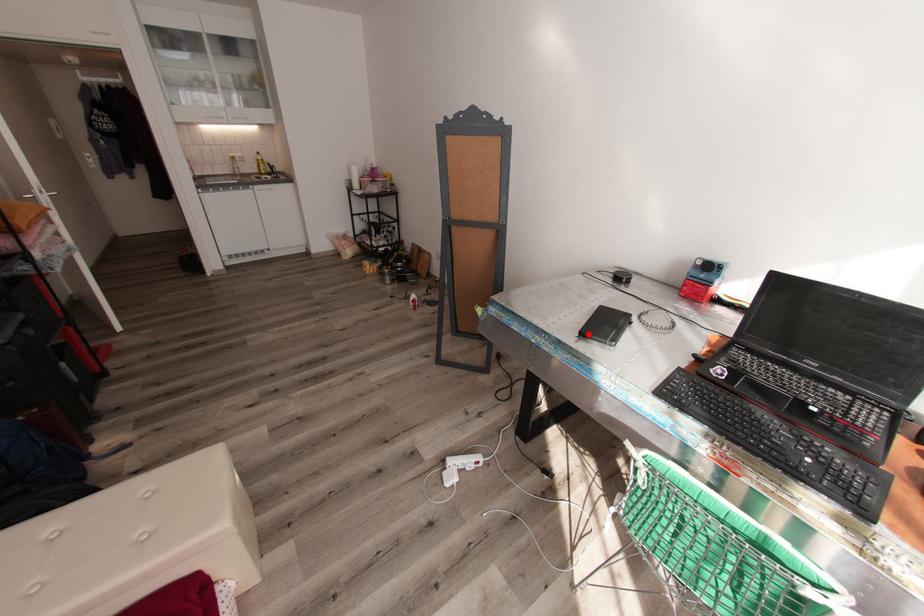
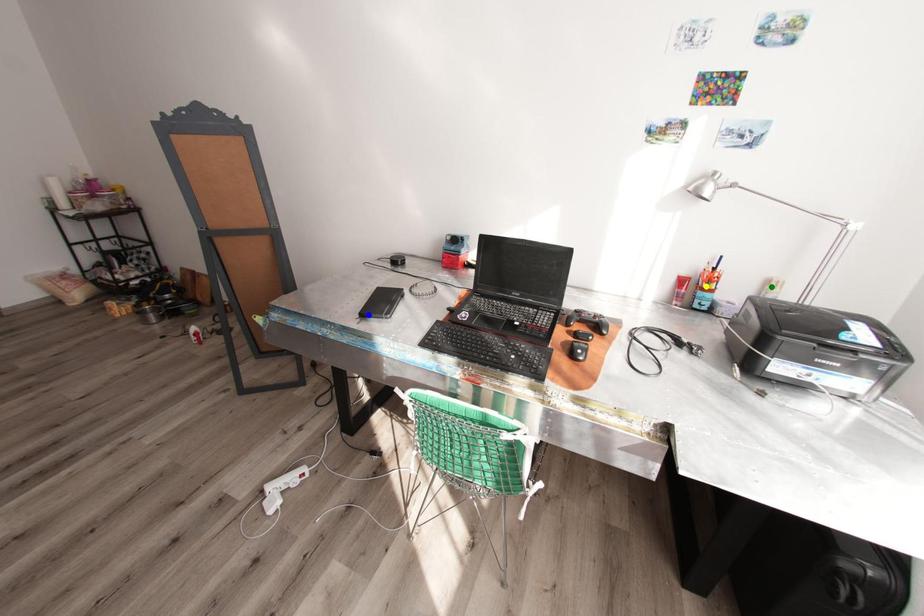
Question: I am providing you with two images of the same scene from different viewpoints. A red point is marked on the first image. You are given multiple points on the second image. In image 2, which mark is for the same physical point as the one in image 1?

Choices:
 (A) yellow point
 (B) green point
 (C) blue point

Answer: (C)